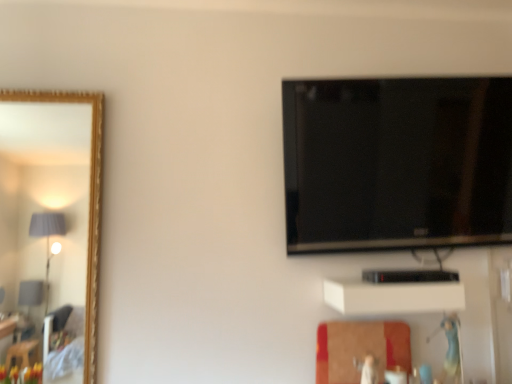
Locate an element on the screen. The height and width of the screenshot is (384, 512). white matte cabinet at lower center is located at coordinates (393, 297).

The width and height of the screenshot is (512, 384). What do you see at coordinates (393, 297) in the screenshot?
I see `white matte cabinet at lower center` at bounding box center [393, 297].

Locate an element on the screen. black glossy tv at upper right is located at coordinates (397, 163).

This screenshot has height=384, width=512. What do you see at coordinates (397, 163) in the screenshot?
I see `black glossy tv at upper right` at bounding box center [397, 163].

Where is `white matte cabinet at lower center`? This screenshot has height=384, width=512. white matte cabinet at lower center is located at coordinates [393, 297].

Which is more to the left, white matte cabinet at lower center or black glossy tv at upper right?

Positioned to the left is white matte cabinet at lower center.

Which object is further away from the camera taking this photo, white matte cabinet at lower center or black glossy tv at upper right?

black glossy tv at upper right is behind.

Is point (451, 310) positioned in front of point (501, 142)?

Yes, point (451, 310) is in front of point (501, 142).

From the image's perspective, between white matte cabinet at lower center and black glossy tv at upper right, which one is located above?

black glossy tv at upper right.

From a real-world perspective, is white matte cabinet at lower center on black glossy tv at upper right?

No.

Considering the sizes of objects white matte cabinet at lower center and black glossy tv at upper right in the image provided, who is thinner, white matte cabinet at lower center or black glossy tv at upper right?

black glossy tv at upper right is thinner.

In terms of height, does white matte cabinet at lower center look taller or shorter compared to black glossy tv at upper right?

white matte cabinet at lower center is shorter than black glossy tv at upper right.

Is white matte cabinet at lower center bigger than black glossy tv at upper right?

Incorrect, white matte cabinet at lower center is not larger than black glossy tv at upper right.

Is white matte cabinet at lower center not inside black glossy tv at upper right?

Indeed, white matte cabinet at lower center is completely outside black glossy tv at upper right.

Are white matte cabinet at lower center and black glossy tv at upper right beside each other?

There is a gap between white matte cabinet at lower center and black glossy tv at upper right.

Is white matte cabinet at lower center facing towards black glossy tv at upper right?

No, white matte cabinet at lower center is not aimed at black glossy tv at upper right.

In the scene shown: How distant is white matte cabinet at lower center from black glossy tv at upper right?

37.77 centimeters.

Find the location of `television on the right of the white matte cabinet at lower center`. television on the right of the white matte cabinet at lower center is located at coordinates pos(397,163).

Is black glossy tv at upper right to the left or to the right of white matte cabinet at lower center in the image?

Based on their positions, black glossy tv at upper right is located to the right of white matte cabinet at lower center.

From the picture: Is black glossy tv at upper right further to camera compared to white matte cabinet at lower center?

Yes, black glossy tv at upper right is further from the camera.

Is point (313, 203) less distant than point (417, 305)?

No, it is not.

From the image's perspective, is black glossy tv at upper right located above white matte cabinet at lower center?

Yes.

From a real-world perspective, which is physically below, black glossy tv at upper right or white matte cabinet at lower center?

white matte cabinet at lower center is physically lower.

Considering the sizes of objects black glossy tv at upper right and white matte cabinet at lower center in the image provided, who is wider, black glossy tv at upper right or white matte cabinet at lower center?

white matte cabinet at lower center.

Which of these two, black glossy tv at upper right or white matte cabinet at lower center, stands shorter?

Standing shorter between the two is white matte cabinet at lower center.

Which of these two, black glossy tv at upper right or white matte cabinet at lower center, is smaller?

Smaller between the two is white matte cabinet at lower center.

Is black glossy tv at upper right located outside white matte cabinet at lower center?

black glossy tv at upper right lies outside white matte cabinet at lower center's area.

Does black glossy tv at upper right touch white matte cabinet at lower center?

No, black glossy tv at upper right is not with white matte cabinet at lower center.

Is black glossy tv at upper right oriented towards white matte cabinet at lower center?

No, black glossy tv at upper right is not oriented towards white matte cabinet at lower center.

Consider the image. How different are the orientations of black glossy tv at upper right and white matte cabinet at lower center in degrees?

The facing directions of black glossy tv at upper right and white matte cabinet at lower center are 0.715 degrees apart.

How distant is black glossy tv at upper right from white matte cabinet at lower center?

black glossy tv at upper right and white matte cabinet at lower center are 14.87 inches apart from each other.

I want to click on cabinet on the left of black glossy tv at upper right, so click(x=393, y=297).

At what (x,y) coordinates should I click in order to perform the action: click on cabinet below the black glossy tv at upper right (from a real-world perspective). Please return your answer as a coordinate pair (x, y). The height and width of the screenshot is (384, 512). Looking at the image, I should click on (x=393, y=297).

Locate an element on the screen. The width and height of the screenshot is (512, 384). television above the white matte cabinet at lower center (from a real-world perspective) is located at coordinates (397, 163).